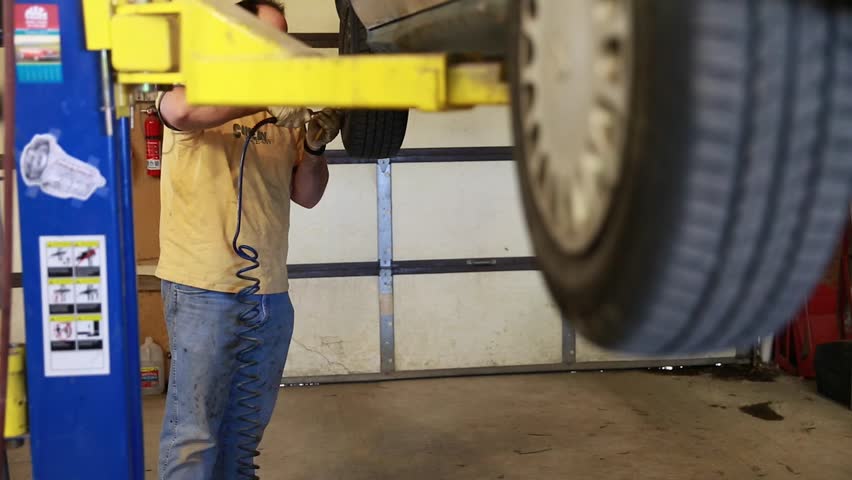
Where is `stickers`? This screenshot has height=480, width=852. stickers is located at coordinates (89, 272), (65, 180), (38, 50).